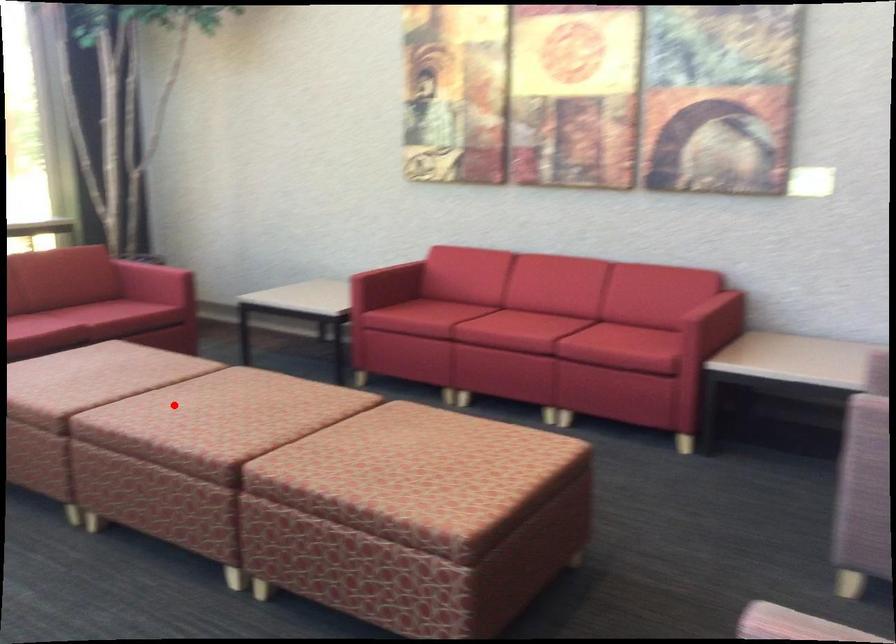
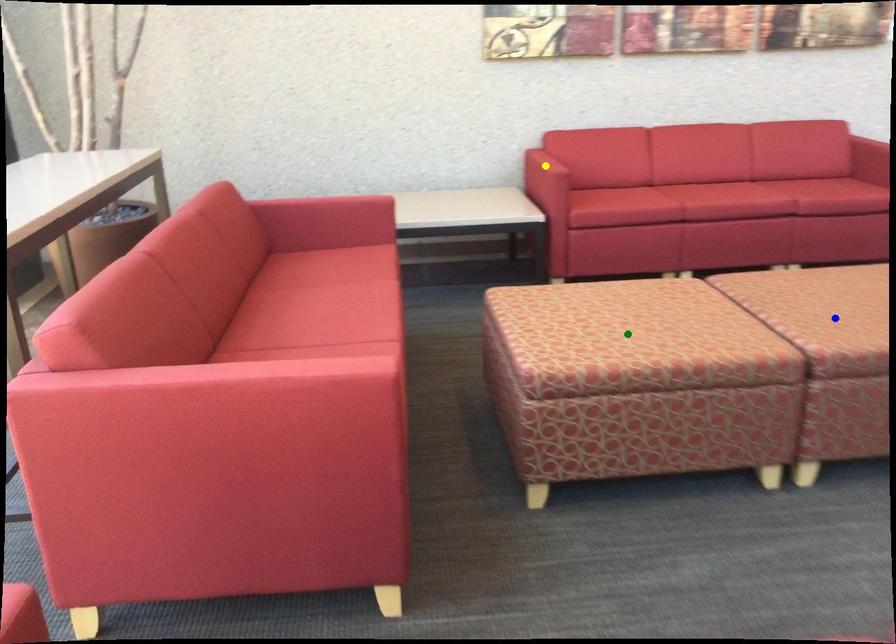
Question: I am providing you with two images of the same scene from different viewpoints. A red point is marked on the first image. You are given multiple points on the second image. Which point in image 2 is actually the same real-world point as the red point in image 1?

Choices:
 (A) green point
 (B) blue point
 (C) yellow point

Answer: (B)